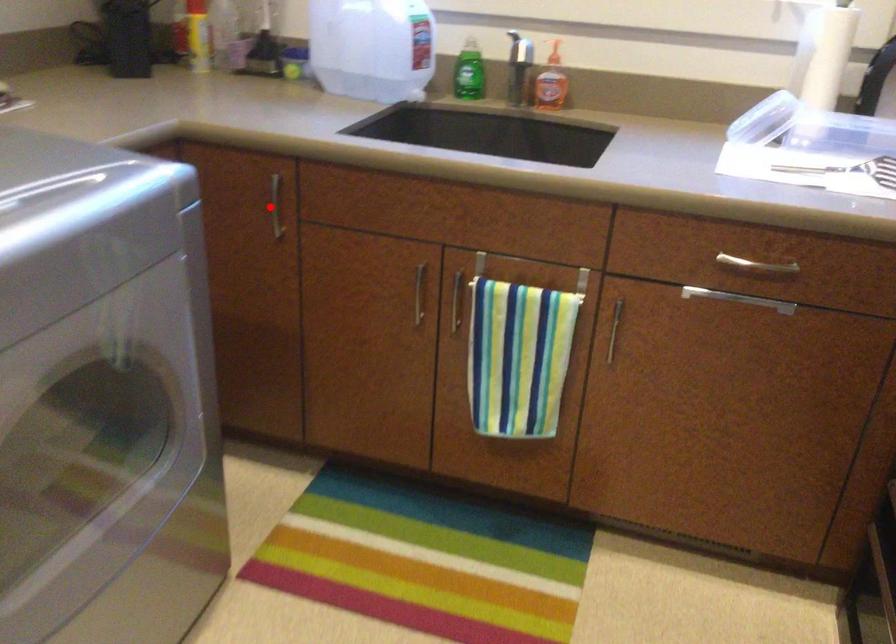
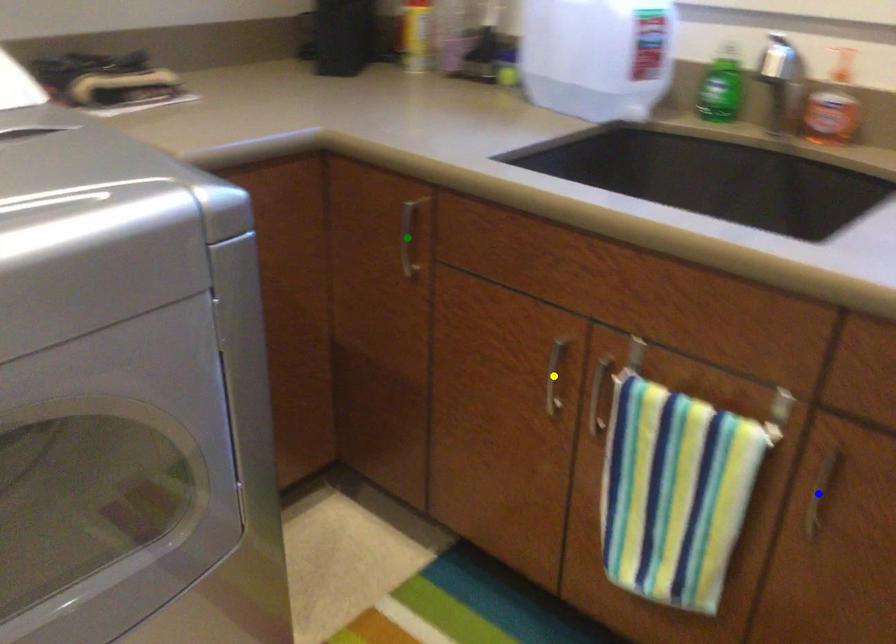
Question: I am providing you with two images of the same scene from different viewpoints. A red point is marked on the first image. You are given multiple points on the second image. Which spot in image 2 lines up with the point in image 1?

Choices:
 (A) yellow point
 (B) blue point
 (C) green point

Answer: (C)